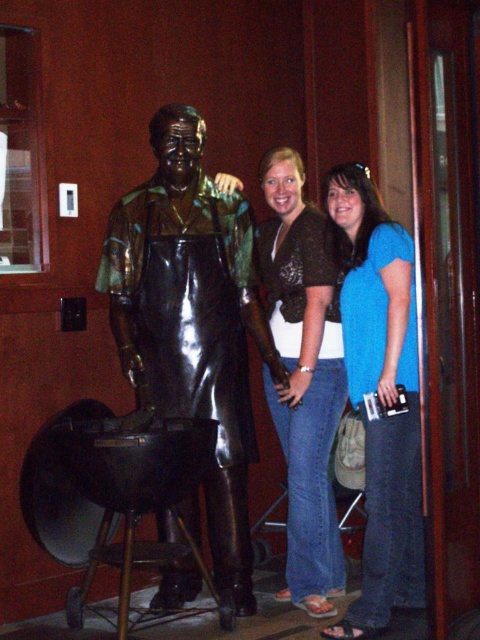
Question: Does bronze statue at center have a smaller size compared to blue cotton shirt at center?

Choices:
 (A) no
 (B) yes

Answer: (A)

Question: Which point is closer to the camera?

Choices:
 (A) (314, 458)
 (B) (395, 314)

Answer: (B)

Question: Does bronze statue at center have a larger size compared to blue cotton shirt at center?

Choices:
 (A) yes
 (B) no

Answer: (A)

Question: Can you confirm if bronze statue at center is bigger than brown textured shirt at center?

Choices:
 (A) no
 (B) yes

Answer: (B)

Question: Based on their relative distances, which object is farther from the blue cotton shirt at center?

Choices:
 (A) bronze statue at center
 (B) brown textured shirt at center

Answer: (A)

Question: Estimate the real-world distances between objects in this image. Which object is closer to the brown textured shirt at center?

Choices:
 (A) blue cotton shirt at center
 (B) bronze statue at center

Answer: (B)